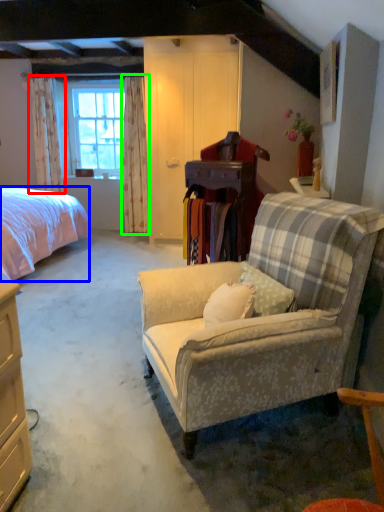
Question: Which object is the closest to the curtain (highlighted by a red box)? Choose among these: bed (highlighted by a blue box) or curtain (highlighted by a green box).

Choices:
 (A) bed
 (B) curtain

Answer: (B)